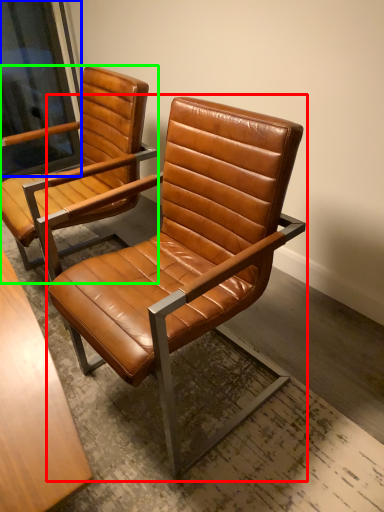
Question: Based on their relative distances, which object is nearer to chair (highlighted by a red box)? Choose from window screen (highlighted by a blue box) and chair (highlighted by a green box).

Choices:
 (A) window screen
 (B) chair

Answer: (B)